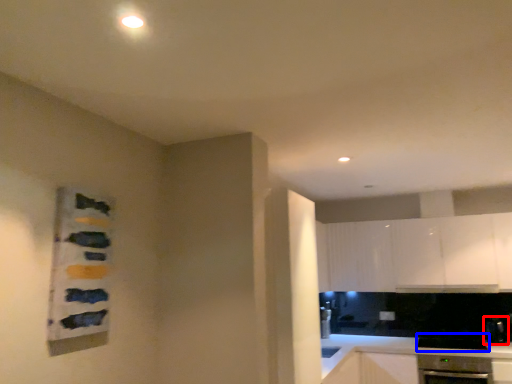
Question: Which object is closer to the camera taking this photo, appliance (highlighted by a red box) or appliance (highlighted by a blue box)?

Choices:
 (A) appliance
 (B) appliance

Answer: (B)